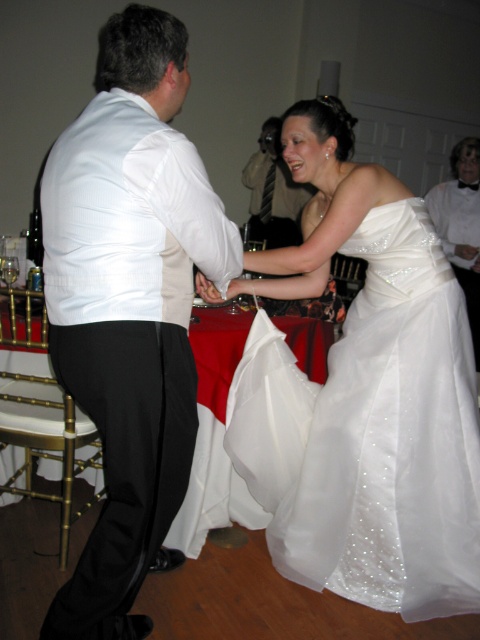
Which of these two, white satin vest at left or white satin bow tie at upper right, stands shorter?

white satin bow tie at upper right

This screenshot has height=640, width=480. Identify the location of white satin vest at left. (129, 305).

Can you confirm if satin white dress at center is wider than white satin bow tie at upper right?

Yes, satin white dress at center is wider than white satin bow tie at upper right.

Is satin white dress at center to the left of white satin bow tie at upper right from the viewer's perspective?

Indeed, satin white dress at center is positioned on the left side of white satin bow tie at upper right.

Image resolution: width=480 pixels, height=640 pixels. What do you see at coordinates (376, 392) in the screenshot?
I see `satin white dress at center` at bounding box center [376, 392].

Locate an element on the screen. Image resolution: width=480 pixels, height=640 pixels. satin white dress at center is located at coordinates (376, 392).

Does white satin bow tie at upper right appear over matte white shirt at center?

No.

Between point (442, 228) and point (282, 161), which one is positioned in front?

Point (442, 228) is more forward.

Which is in front, point (472, 324) or point (249, 160)?

Point (472, 324) is in front.

Identify the location of white satin bow tie at upper right. (462, 225).